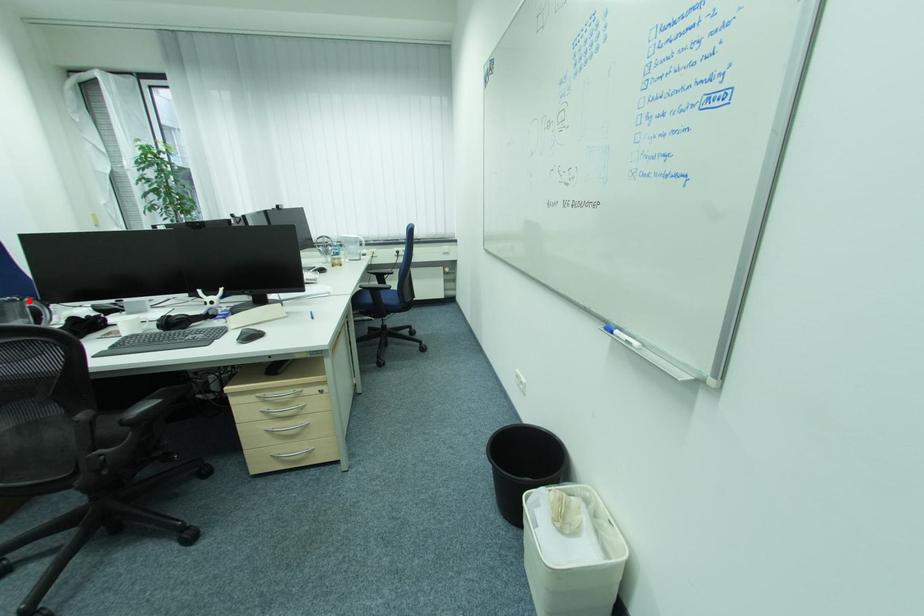
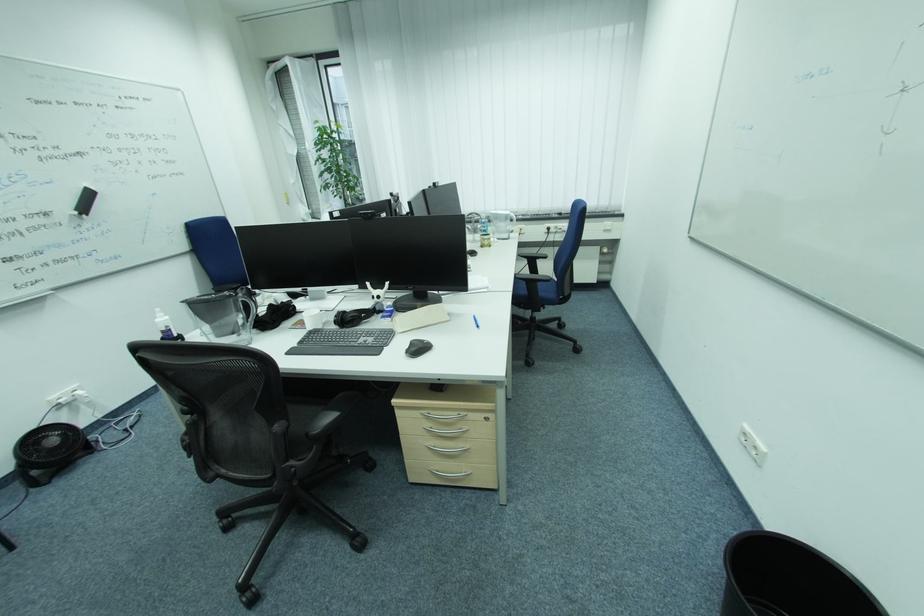
Question: I am providing you with two images of the same scene from different viewpoints. In image1, a red point is highlighted. Considering the same 3D point in image2, which of the following is correct?

Choices:
 (A) It is closer
 (B) It is farther

Answer: (A)